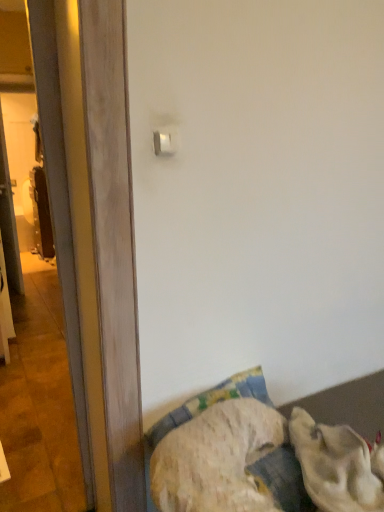
Question: From the image's perspective, is fluffy fabric bed at lower right located above transparent glass screen door at left?

Choices:
 (A) no
 (B) yes

Answer: (A)

Question: Considering the relative positions of fluffy fabric bed at lower right and transparent glass screen door at left in the image provided, is fluffy fabric bed at lower right in front of transparent glass screen door at left?

Choices:
 (A) yes
 (B) no

Answer: (A)

Question: From a real-world perspective, is fluffy fabric bed at lower right on transparent glass screen door at left?

Choices:
 (A) no
 (B) yes

Answer: (A)

Question: Considering the relative sizes of fluffy fabric bed at lower right and transparent glass screen door at left in the image provided, is fluffy fabric bed at lower right shorter than transparent glass screen door at left?

Choices:
 (A) no
 (B) yes

Answer: (B)

Question: Does fluffy fabric bed at lower right have a larger size compared to transparent glass screen door at left?

Choices:
 (A) no
 (B) yes

Answer: (B)

Question: Considering the positions of fluffy fabric bed at lower right and white fluffy dog at lower right in the image, is fluffy fabric bed at lower right bigger or smaller than white fluffy dog at lower right?

Choices:
 (A) small
 (B) big

Answer: (B)

Question: Is fluffy fabric bed at lower right inside or outside of white fluffy dog at lower right?

Choices:
 (A) inside
 (B) outside

Answer: (B)

Question: From the image's perspective, is fluffy fabric bed at lower right located above or below white fluffy dog at lower right?

Choices:
 (A) above
 (B) below

Answer: (B)

Question: In the image, is fluffy fabric bed at lower right on the left side or the right side of white fluffy dog at lower right?

Choices:
 (A) left
 (B) right

Answer: (A)

Question: From their relative heights in the image, would you say fluffy fabric bed at lower right is taller or shorter than white plastic light switch at upper center?

Choices:
 (A) short
 (B) tall

Answer: (B)

Question: Looking at their shapes, would you say fluffy fabric bed at lower right is wider or thinner than white plastic light switch at upper center?

Choices:
 (A) thin
 (B) wide

Answer: (B)

Question: From the image's perspective, is fluffy fabric bed at lower right positioned above or below white plastic light switch at upper center?

Choices:
 (A) below
 (B) above

Answer: (A)

Question: Looking at the image, does fluffy fabric bed at lower right seem bigger or smaller compared to white plastic light switch at upper center?

Choices:
 (A) big
 (B) small

Answer: (A)

Question: In terms of height, does white plastic light switch at upper center look taller or shorter compared to transparent glass screen door at left?

Choices:
 (A) short
 (B) tall

Answer: (A)

Question: In the image, is white plastic light switch at upper center on the left side or the right side of transparent glass screen door at left?

Choices:
 (A) right
 (B) left

Answer: (A)